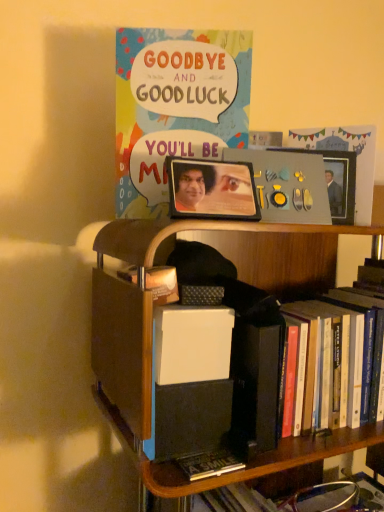
Question: Would you say metallic silver picture frame at upper right, the second picture frame when ordered from front to back, is inside or outside wooden bookcase at center?

Choices:
 (A) inside
 (B) outside

Answer: (B)

Question: Is metallic silver picture frame at upper right, acting as the 1th picture frame starting from the back, bigger or smaller than wooden bookcase at center?

Choices:
 (A) small
 (B) big

Answer: (A)

Question: Estimate the real-world distances between objects in this image. Which object is farther from the metallic photo frame at center, placed as the first picture frame when sorted from front to back?

Choices:
 (A) wooden bookcase at center
 (B) metallic silver picture frame at upper right, the second picture frame when ordered from front to back
 (C) matte paper comic book at upper center

Answer: (B)

Question: Which object is positioned farthest from the metallic silver picture frame at upper right, the 2th picture frame positioned from the left?

Choices:
 (A) metallic photo frame at center, the 2th picture frame when ordered from right to left
 (B) wooden bookcase at center
 (C) matte paper comic book at upper center

Answer: (C)